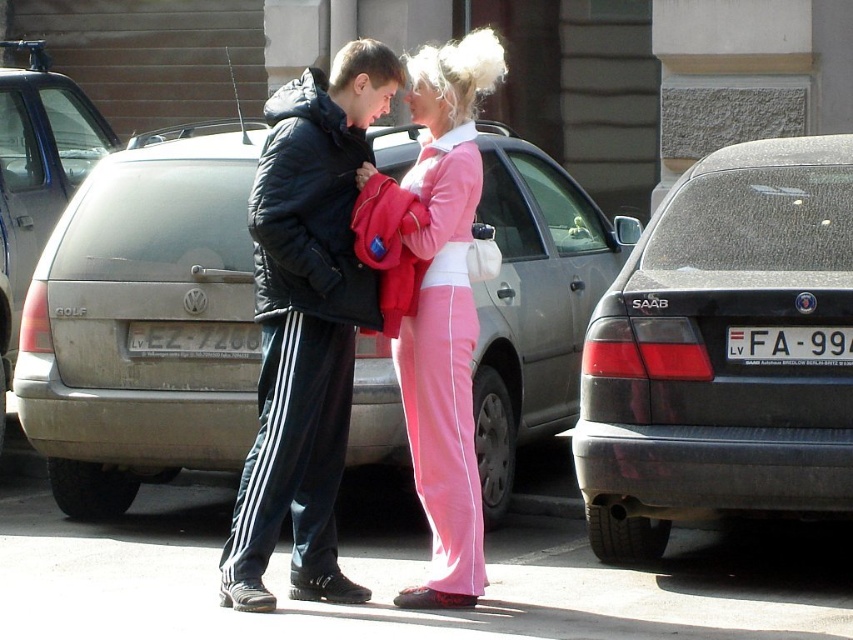
Question: Considering the relative positions of black puffy jacket at center and pink fabric pants at center in the image provided, where is black puffy jacket at center located with respect to pink fabric pants at center?

Choices:
 (A) left
 (B) right

Answer: (A)

Question: Which point is farther from the camera taking this photo?

Choices:
 (A) (312, 337)
 (B) (778, 342)
 (C) (363, 428)

Answer: (C)

Question: Which object appears farthest from the camera in this image?

Choices:
 (A) dark gray car at right
 (B) black puffy jacket at center

Answer: (A)

Question: Is pink fabric pants at center above white plastic license plate at center?

Choices:
 (A) yes
 (B) no

Answer: (A)

Question: Considering the real-world distances, which object is farthest from the dark gray car at right?

Choices:
 (A) silver metallic hatchback at center
 (B) matte silver car at center
 (C) white plastic license plate at center
 (D) pink fabric pants at center

Answer: (B)

Question: Does silver metallic hatchback at center have a lesser width compared to pink fabric pants at center?

Choices:
 (A) no
 (B) yes

Answer: (A)